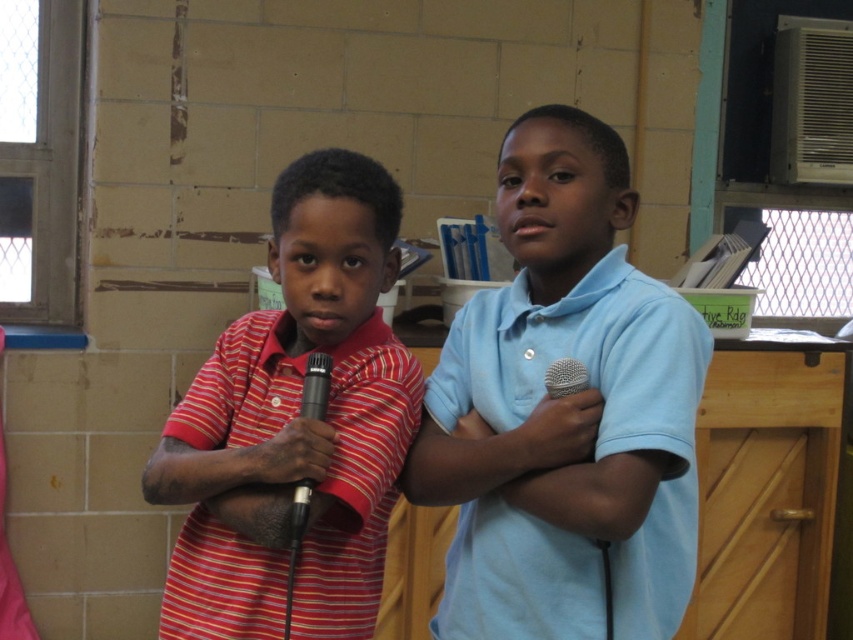
From the picture: You are a photographer trying to capture a closeup shot of the boy on the left. You notice two points in the scene at coordinates point (641, 310) and point (212, 355). Which point should you focus on to ensure the boy on the left is in sharp focus?

You should focus on point (641, 310) because it is closer to the camera than point (212, 355), which would better capture the boy on the left in sharp focus.

You are a photographer setting up for a group photo. You need to ensure that the matte blue shirt at center and the black matte microphone at center are both clearly visible in the shot. Given their sizes, which object might require more careful framing to avoid being too small in the image?

The black matte microphone at center is smaller in width compared to the matte blue shirt at center, so it might require more careful framing to ensure it is not too small in the image.

You are a photographer standing at the center of the room. You see a point marked at coordinates [294,424]. What object is located at that point?

The point at coordinates [294,424] marks the striped cotton shirt at center.